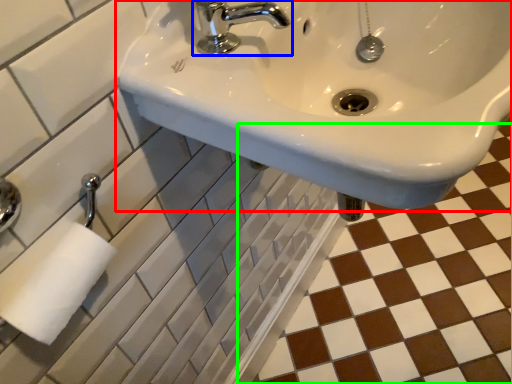
Question: Which object is the closest to the sink (highlighted by a red box)? Choose among these: tap (highlighted by a blue box) or ceramic tile (highlighted by a green box).

Choices:
 (A) tap
 (B) ceramic tile

Answer: (A)